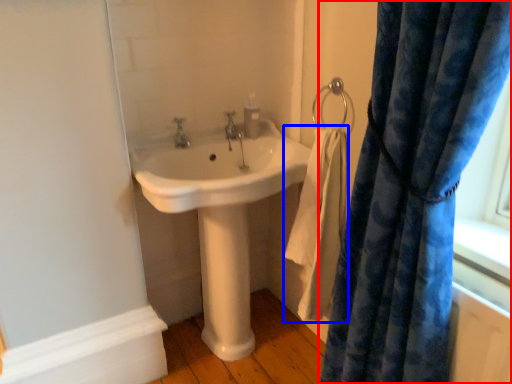
Question: Which object appears farthest to the camera in this image, curtain (highlighted by a red box) or bath towel (highlighted by a blue box)?

Choices:
 (A) curtain
 (B) bath towel

Answer: (B)